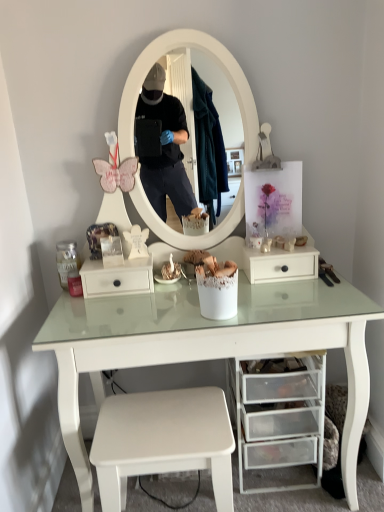
Question: From their relative heights in the image, would you say transparent plastic drawers at lower center, the 1th drawer from the right, is taller or shorter than white matte stool at lower center?

Choices:
 (A) tall
 (B) short

Answer: (A)

Question: From a real-world perspective, is transparent plastic drawers at lower center, which ranks as the 1th drawer in bottom-to-top order, physically located above or below white matte stool at lower center?

Choices:
 (A) above
 (B) below

Answer: (A)

Question: Estimate the real-world distances between objects in this image. Which object is farther from the white matte stool at lower center?

Choices:
 (A) transparent plastic drawers at lower center, the 1th drawer from the right
 (B) white matte drawer at center, which is counted as the first drawer, starting from the left

Answer: (B)

Question: Based on their relative distances, which object is farther from the white matte stool at lower center?

Choices:
 (A) white matte drawer at center, the 2th drawer from the right
 (B) transparent plastic drawers at lower center, the 1th drawer from the right

Answer: (A)